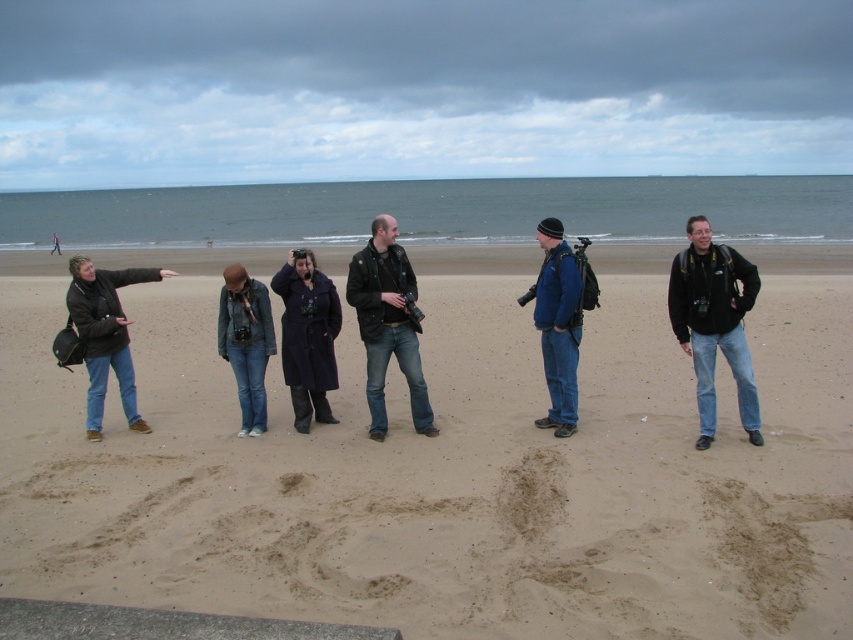
You are a photographer trying to capture a group photo of the six people on the beach. You notice two jackets in the scene, the black matte jacket at center and the matte black jacket at left. Which jacket should you focus on if you want to include both jackets in the frame without cropping either?

The black matte jacket at center is taller than the matte black jacket at left, so focusing on the black matte jacket at center would ensure both jackets are visible in the frame since it is taller and can serve as a central point of reference.

You are a photographer trying to capture a clear shot of the black matte jacket at center and the denim jacket at center. Which jacket should you focus on first to ensure it appears sharp in the photo?

The black matte jacket at center is in front of the denim jacket at center, so you should focus on the black matte jacket at center first to ensure it appears sharp in the photo.

You are a photographer trying to capture the group of people on the beach. You notice the black matte jacket at center and the blue fabric jacket at center. Which jacket is covering part of the other in the photo?

The black matte jacket at center is positioned over the blue fabric jacket at center, so it is covering part of the blue fabric jacket at center in the photo.